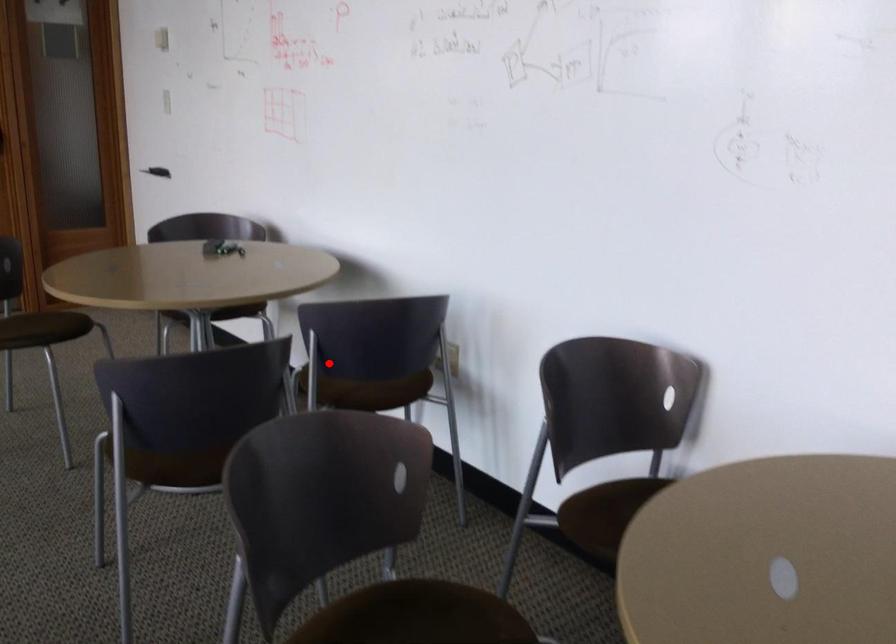
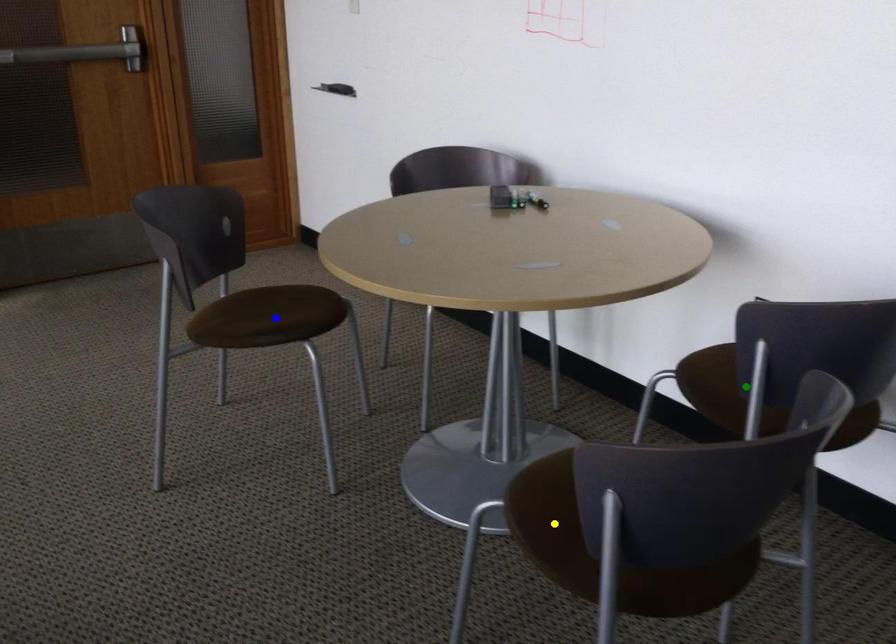
Question: I am providing you with two images of the same scene from different viewpoints. A red point is marked on the first image. You are given multiple points on the second image. Which mark in image 2 goes with the point in image 1?

Choices:
 (A) green point
 (B) blue point
 (C) yellow point

Answer: (A)